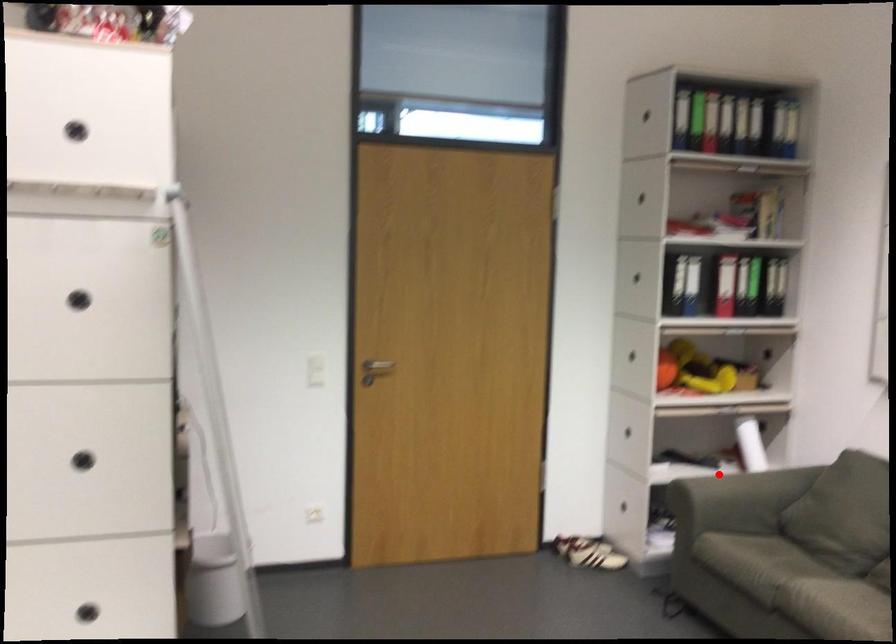
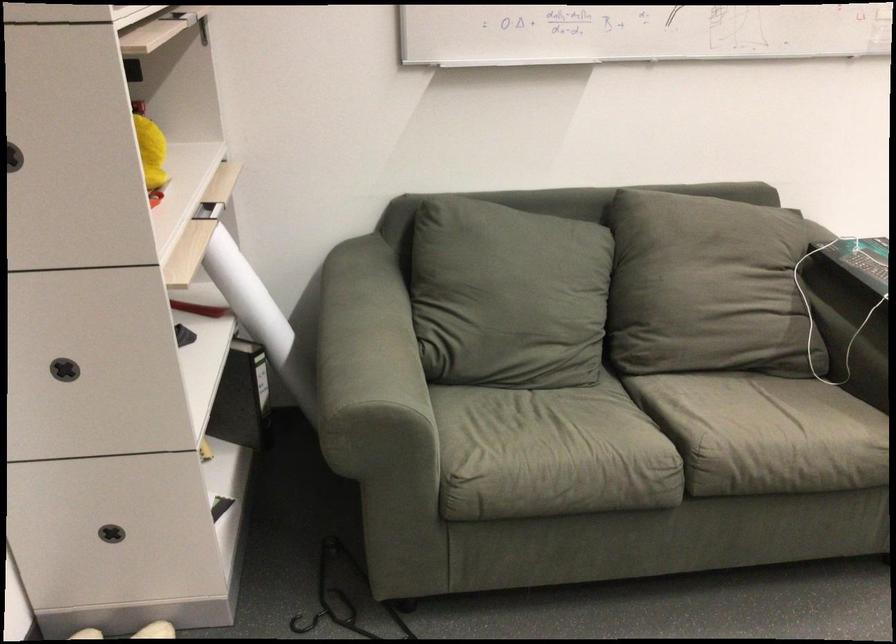
Where in the second image is the point corresponding to the highlighted location from the first image?

(358, 342)